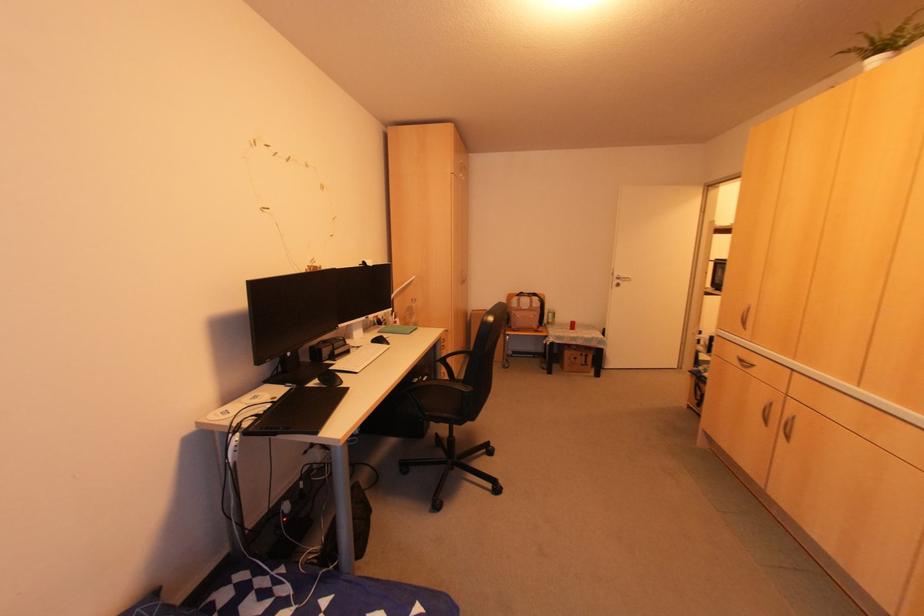
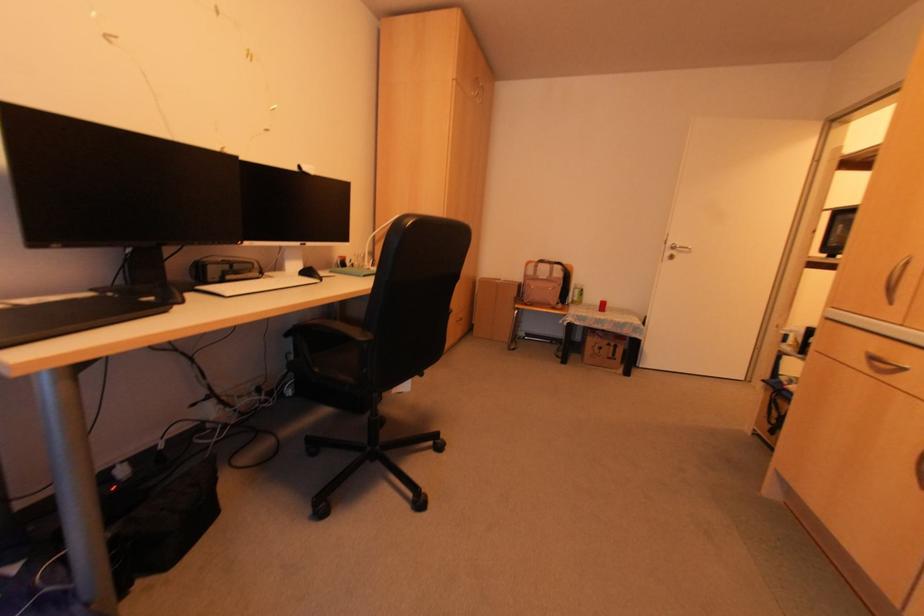
In a continuous first-person perspective shot, in which direction is the camera moving?

The movement direction of the cameraman is right, forward.